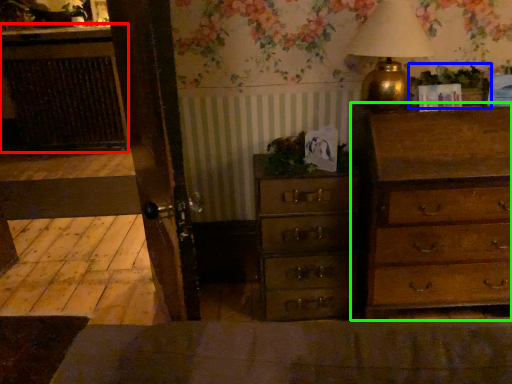
Question: Which object is the closest to the cabinetry (highlighted by a red box)? Choose among these: plant (highlighted by a blue box) or chest of drawers (highlighted by a green box).

Choices:
 (A) plant
 (B) chest of drawers

Answer: (B)